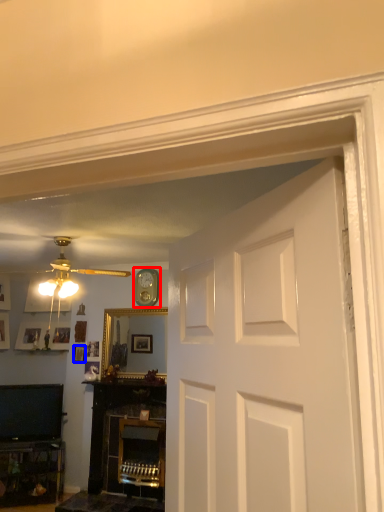
Question: Which point is closer to the camera, clock (highlighted by a red box) or picture frame (highlighted by a blue box)?

Choices:
 (A) clock
 (B) picture frame

Answer: (A)